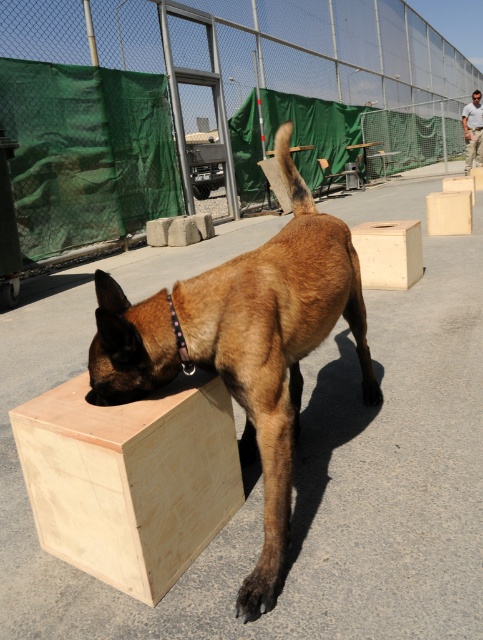
You are a photographer standing in front of the brown wooden dog at center. You want to take a closeup shot without moving closer than 1 meter for safety. Is the distance sufficient?

The brown wooden dog at center is 1.34 meters away from viewer, so yes, the distance is sufficient as it is more than 1 meter.

You are a photographer setting up a shot of the Malinois dog and the wooden box. You need to place a marker at point (251,593) and another at point (453,204). Which marker will appear closer to the camera in the final photo?

Point (251,593) will appear closer to the camera in the final photo because it is closer to the camera than point (453,204) according to the description.

You are a photographer setting up a shot of the Malinois dog and the wooden box. You want to focus on the point closer to the camera between point [174,326] and point [402,284]. Which point should you choose?

Point [174,326] is closer to the camera than point [402,284], so you should choose point [174,326] for focusing.